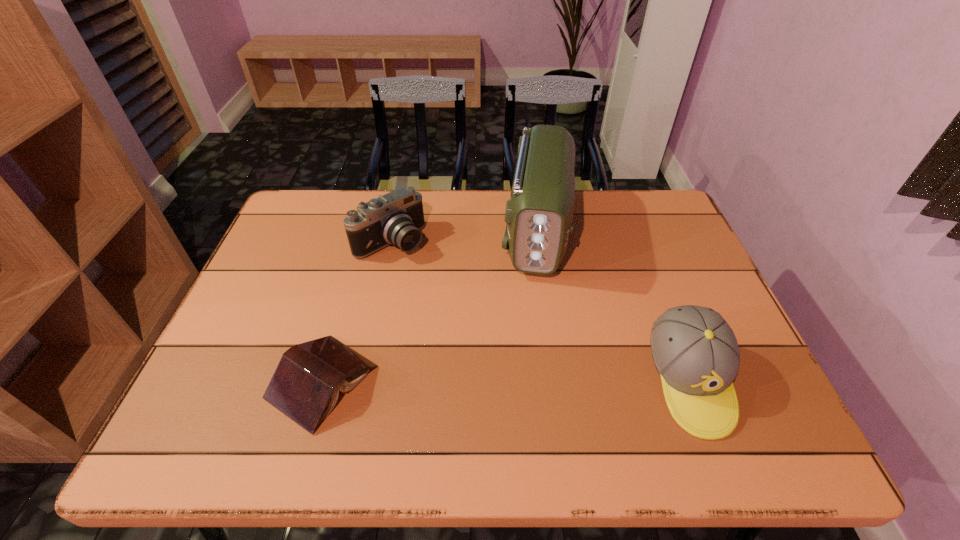
I want to click on vacant region at the far edge of the desktop, so click(x=449, y=202).

Find the location of a particular element. free space at the near edge of the desktop is located at coordinates (342, 400).

At what (x,y) coordinates should I click in order to perform the action: click on vacant space at the left edge. Please return your answer as a coordinate pair (x, y). This screenshot has height=540, width=960. Looking at the image, I should click on (281, 340).

The image size is (960, 540). In order to click on vacant area at the right edge of the desktop in this screenshot , I will do `click(673, 254)`.

You are a GUI agent. You are given a task and a screenshot of the screen. Output one action in this format:
    pyautogui.click(x=<x>, y=<y>)
    Task: Click on the vacant space at the far left corner of the desktop
    This screenshot has width=960, height=540.
    Given the screenshot: What is the action you would take?
    [x=322, y=226]

This screenshot has width=960, height=540. Find the location of `vacant point at the far right corner`. vacant point at the far right corner is located at coordinates (645, 205).

Locate an element on the screen. Image resolution: width=960 pixels, height=540 pixels. free spot between the camera and the book is located at coordinates (x=357, y=312).

At what (x,y) coordinates should I click in order to perform the action: click on empty space between the camera and the baseball cap. Please return your answer as a coordinate pair (x, y). Image resolution: width=960 pixels, height=540 pixels. Looking at the image, I should click on (540, 311).

I want to click on free point between the camera and the rightmost object, so click(540, 311).

The width and height of the screenshot is (960, 540). In order to click on vacant point located between the second object from right to left and the shortest object in this screenshot , I will do `click(429, 307)`.